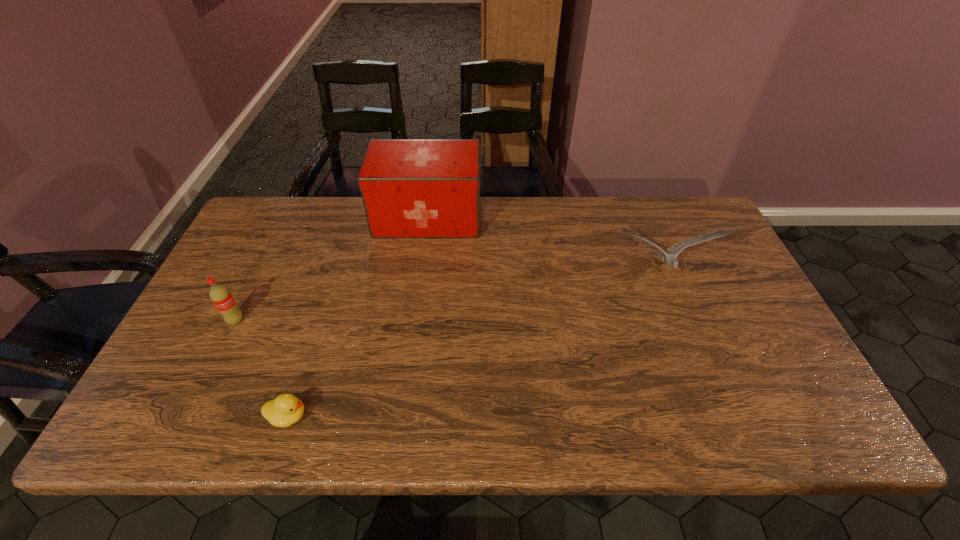
Image resolution: width=960 pixels, height=540 pixels. What are the coordinates of `vacant space located 0.390m on the right of the third farthest object` in the screenshot? It's located at (395, 320).

The height and width of the screenshot is (540, 960). What are the coordinates of `free space located 0.310m on the beak of the third object from right to left` in the screenshot? It's located at (451, 416).

Identify the location of object positioned at the far edge. (410, 188).

Locate an element on the screen. The image size is (960, 540). object that is at the near edge is located at coordinates (286, 409).

At what (x,y) coordinates should I click in order to perform the action: click on object that is at the left edge. Please return your answer as a coordinate pair (x, y). Looking at the image, I should click on (220, 296).

Image resolution: width=960 pixels, height=540 pixels. Identify the location of object situated at the right edge. (670, 259).

This screenshot has width=960, height=540. Find the location of `free space at the far edge`. free space at the far edge is located at coordinates (472, 244).

In the image, there is a desktop. Identify the location of vacant space at the near edge. Image resolution: width=960 pixels, height=540 pixels. (445, 402).

Identify the location of blank area at the right edge. (741, 373).

You are a GUI agent. You are given a task and a screenshot of the screen. Output one action in this format:
    pyautogui.click(x=<x>, y=<y>)
    Task: Click on the free space at the far left corner
    Image resolution: width=960 pixels, height=540 pixels.
    Given the screenshot: What is the action you would take?
    pyautogui.click(x=272, y=231)